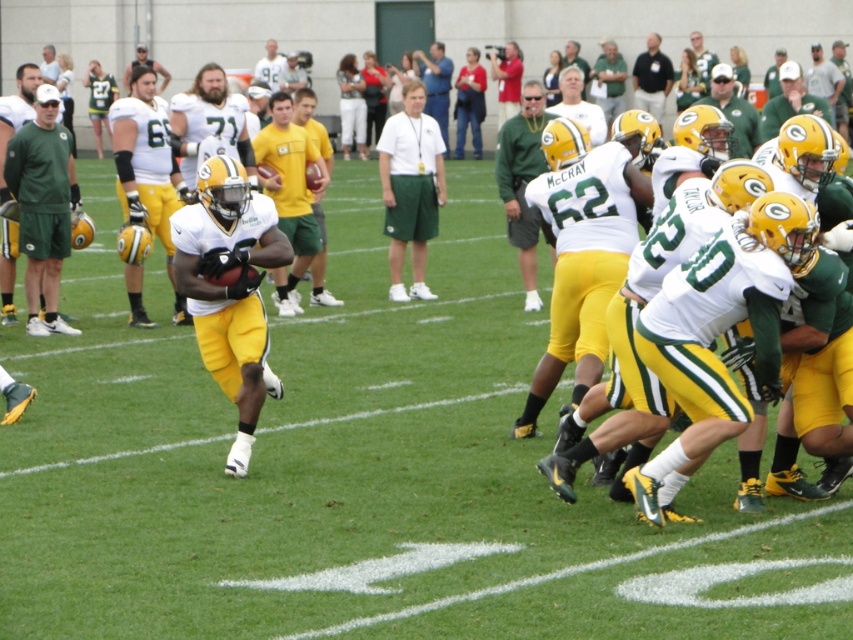
Question: Among these points, which one is farthest from the camera?

Choices:
 (A) (740, 147)
 (B) (607, 109)
 (C) (184, 106)

Answer: (B)

Question: Which of the following is the closest to the observer?

Choices:
 (A) green jersey at center
 (B) matte white jersey at center
 (C) green matte jersey at center

Answer: (C)

Question: Where is green matte jersey at center located in relation to matte white jersey at upper center in the image?

Choices:
 (A) below
 (B) above

Answer: (A)

Question: Is blue shirt at center to the right of matte white jersey at upper center from the viewer's perspective?

Choices:
 (A) yes
 (B) no

Answer: (A)

Question: Can you confirm if green matte shorts at left is positioned to the right of white matte helmet at upper center?

Choices:
 (A) yes
 (B) no

Answer: (B)

Question: Which object is positioned farthest from the dark brown leather jacket at upper center?

Choices:
 (A) green matte shorts at left
 (B) green jersey at center
 (C) blue shirt at center

Answer: (A)